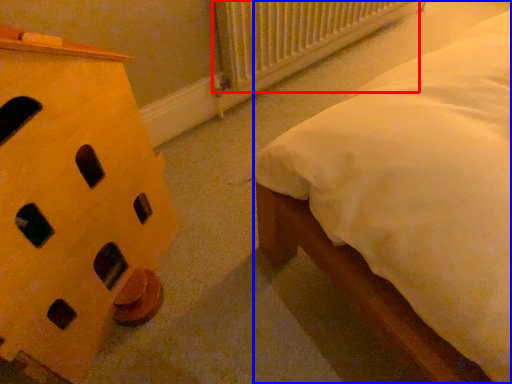
Question: Which object is further to the camera taking this photo, radiator (highlighted by a red box) or nightstand (highlighted by a blue box)?

Choices:
 (A) radiator
 (B) nightstand

Answer: (A)